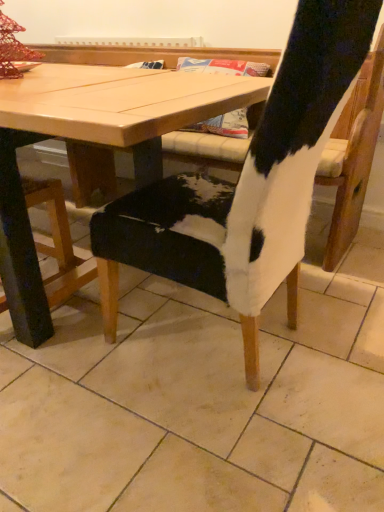
Question: From a real-world perspective, is wooden table at center located higher than cowhide chair at center?

Choices:
 (A) no
 (B) yes

Answer: (B)

Question: Is wooden table at center oriented away from cowhide chair at center?

Choices:
 (A) yes
 (B) no

Answer: (B)

Question: From the image's perspective, is wooden table at center beneath cowhide chair at center?

Choices:
 (A) yes
 (B) no

Answer: (B)

Question: Does wooden table at center appear on the right side of cowhide chair at center?

Choices:
 (A) no
 (B) yes

Answer: (A)

Question: Does wooden table at center lie behind cowhide chair at center?

Choices:
 (A) yes
 (B) no

Answer: (A)

Question: Does point (289, 391) appear closer or farther from the camera than point (256, 351)?

Choices:
 (A) closer
 (B) farther

Answer: (B)

Question: Is cowhide chair at center in front of or behind cowhide chair at center in the image?

Choices:
 (A) front
 (B) behind

Answer: (A)

Question: Based on their positions, is cowhide chair at center located to the left or right of cowhide chair at center?

Choices:
 (A) left
 (B) right

Answer: (B)

Question: Is cowhide chair at center inside or outside of cowhide chair at center?

Choices:
 (A) outside
 (B) inside

Answer: (A)

Question: Based on their sizes in the image, would you say cowhide chair at center is bigger or smaller than cowhide chair at center?

Choices:
 (A) small
 (B) big

Answer: (B)

Question: Is cowhide chair at center in front of or behind cowhide chair at center in the image?

Choices:
 (A) behind
 (B) front

Answer: (A)

Question: From the image's perspective, is cowhide chair at center positioned above or below cowhide chair at center?

Choices:
 (A) below
 (B) above

Answer: (B)

Question: From their relative heights in the image, would you say cowhide chair at center is taller or shorter than cowhide chair at center?

Choices:
 (A) tall
 (B) short

Answer: (A)

Question: In the image, is cowhide chair at center positioned in front of or behind wooden table at center?

Choices:
 (A) front
 (B) behind

Answer: (A)

Question: Based on their sizes in the image, would you say cowhide chair at center is bigger or smaller than wooden table at center?

Choices:
 (A) small
 (B) big

Answer: (A)